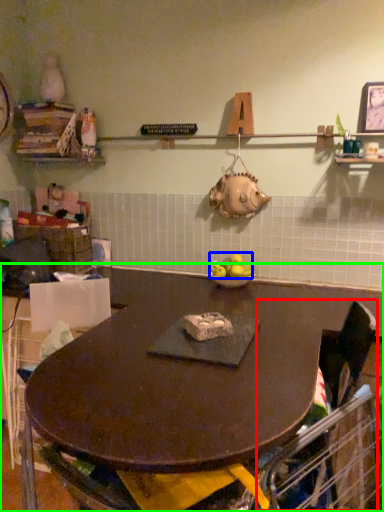
Question: Which is nearer to the swivel chair (highlighted by a red box)? apple (highlighted by a blue box) or table (highlighted by a green box).

Choices:
 (A) apple
 (B) table

Answer: (B)